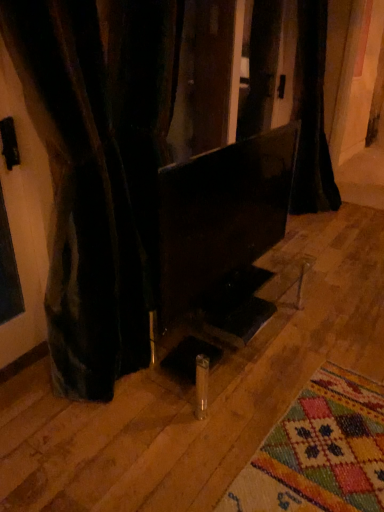
Describe the element at coordinates (81, 198) in the screenshot. I see `velvet black curtain at left` at that location.

Identify the location of velvet black curtain at left. (81, 198).

I want to click on velvet black curtain at left, so click(81, 198).